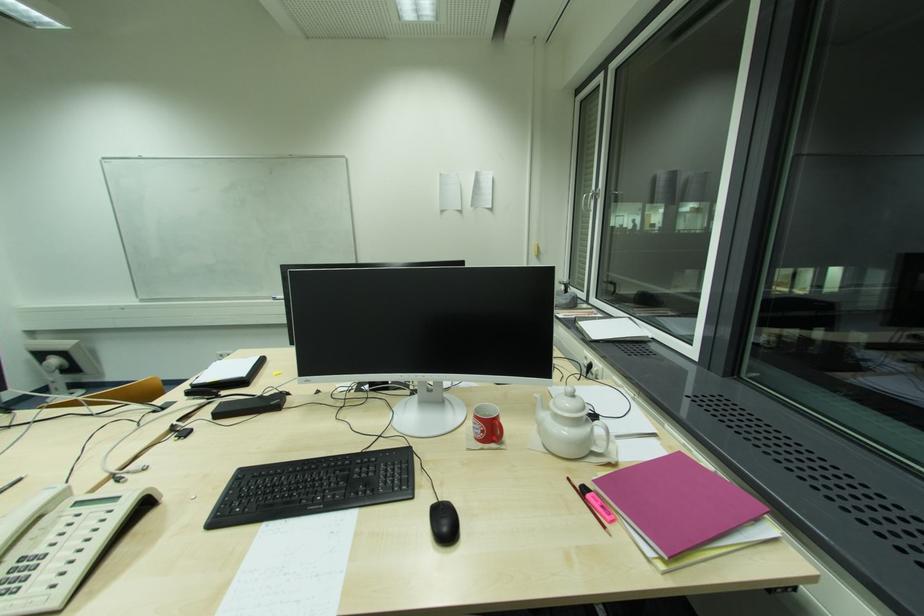
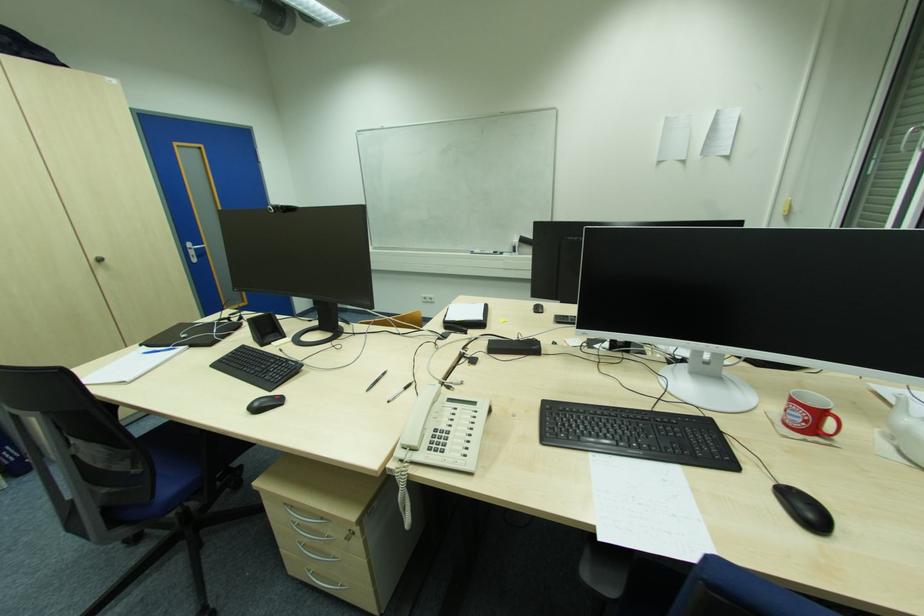
Question: How did the camera likely rotate?

Choices:
 (A) Left
 (B) Right
 (C) Up
 (D) Down

Answer: (A)